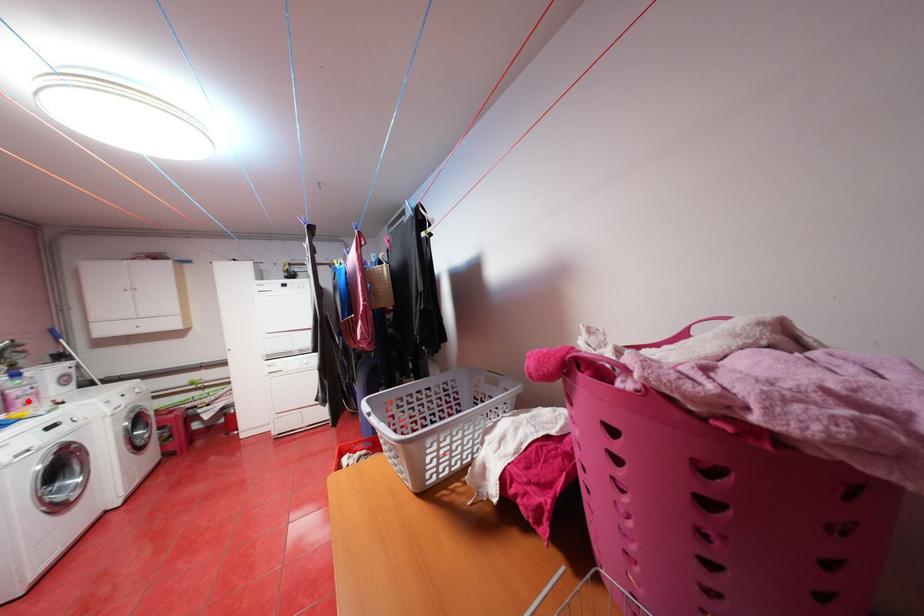
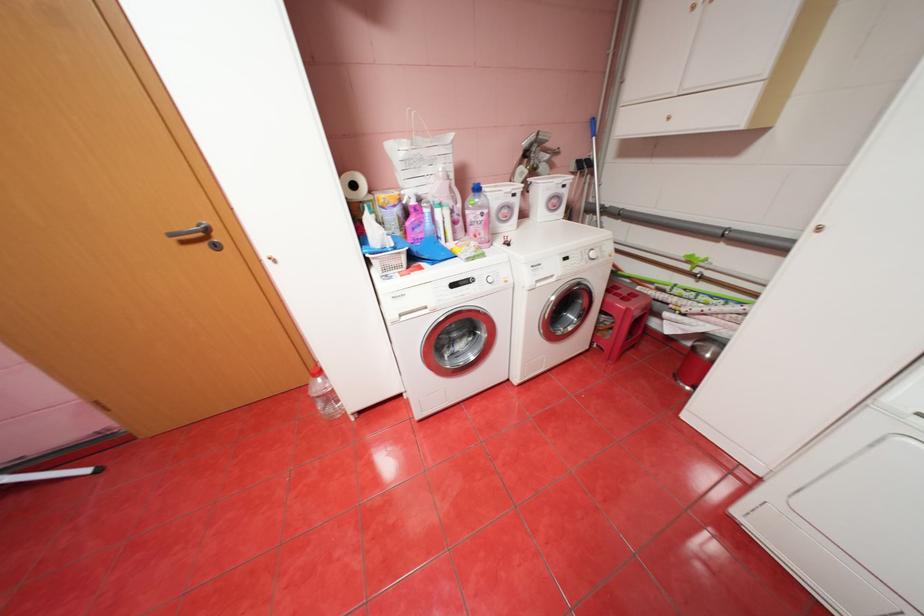
Where in the second image is the point corresponding to the highlighted location from the first image?

(480, 228)